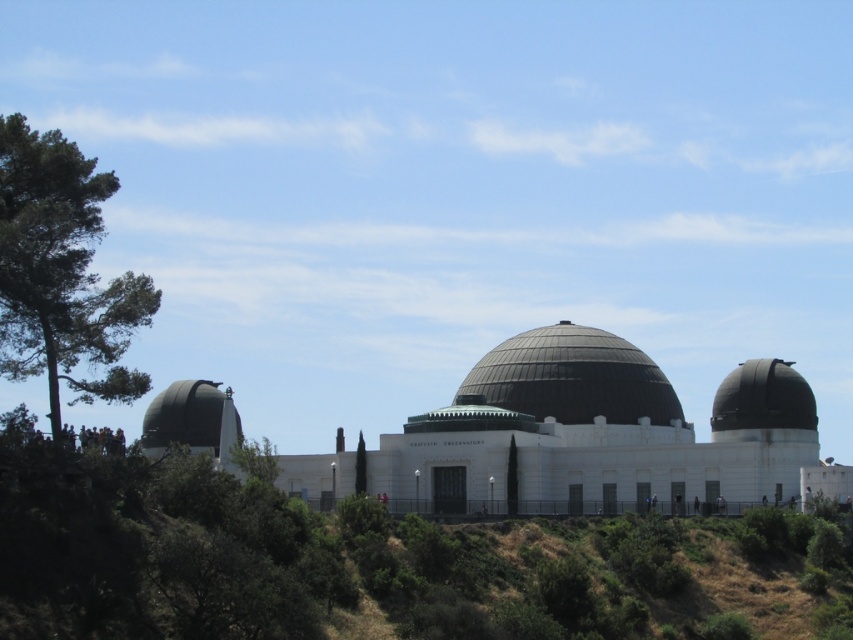
Does green textured tree at left have a larger size compared to shiny black dome at right?

Indeed, green textured tree at left has a larger size compared to shiny black dome at right.

Can you confirm if green textured tree at left is thinner than shiny black dome at right?

Yes, green textured tree at left is thinner than shiny black dome at right.

Locate an element on the screen. Image resolution: width=853 pixels, height=640 pixels. green textured tree at left is located at coordinates (61, 273).

Is shiny dark gray dome at center thinner than shiny black dome at right?

No, shiny dark gray dome at center is not thinner than shiny black dome at right.

Is point (556, 342) farther from camera compared to point (770, 358)?

That is True.

What are the coordinates of `shiny dark gray dome at center` in the screenshot? It's located at (572, 378).

Measure the distance between point (33, 337) and camera.

Point (33, 337) and camera are 224.42 feet apart from each other.

Describe the element at coordinates (61, 273) in the screenshot. I see `green textured tree at left` at that location.

Image resolution: width=853 pixels, height=640 pixels. What are the coordinates of `green textured tree at left` in the screenshot? It's located at tap(61, 273).